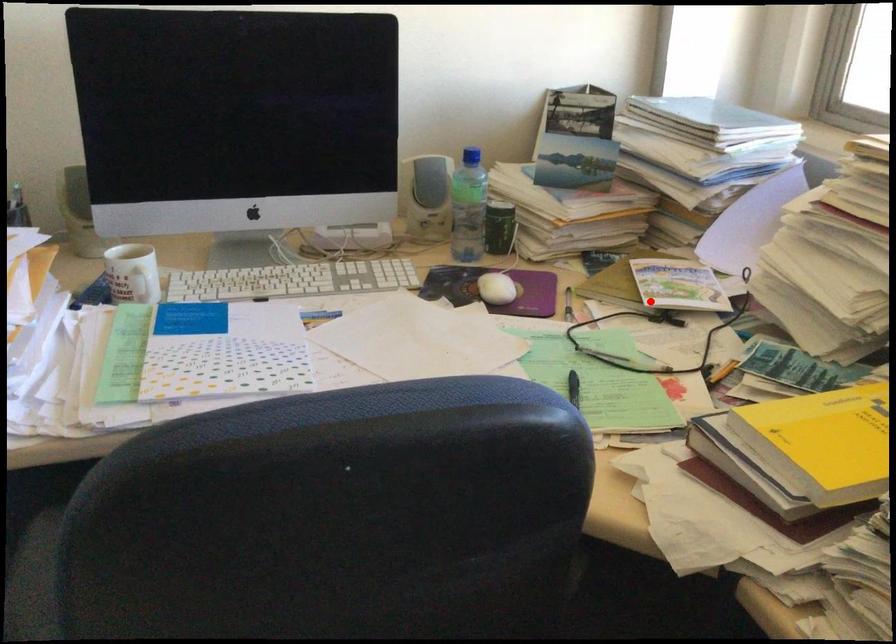
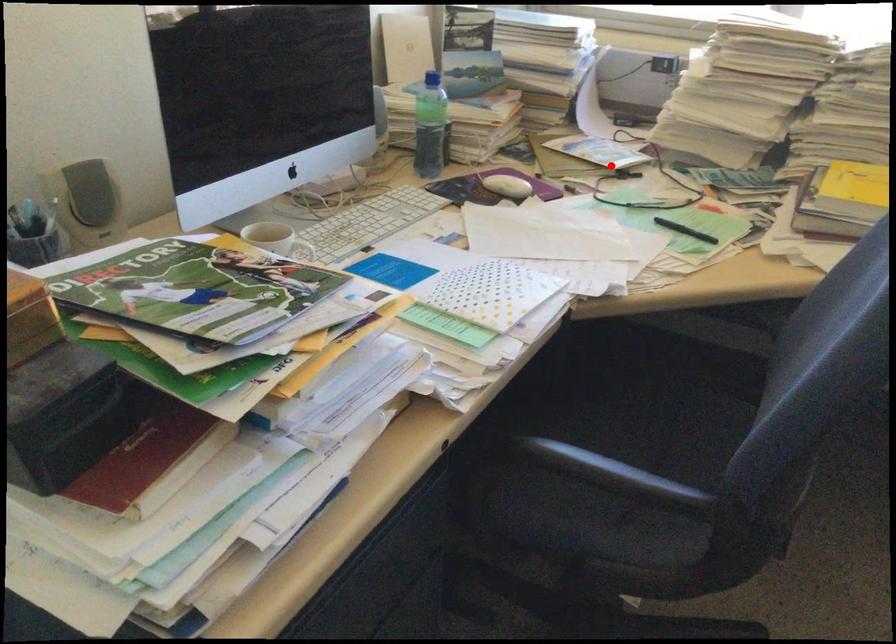
I am providing you with two images of the same scene from different viewpoints. A red point is marked on the first image and another point is marked on the second image. Is the red point in image1 aligned with the point shown in image2?

Yes